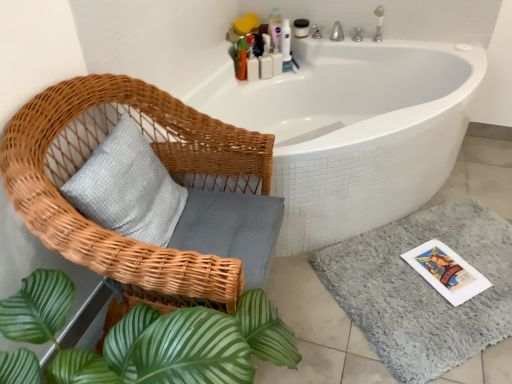
Find the location of a particular element. Image resolution: width=512 pixels, height=384 pixels. vacant space situated on the left part of silver metallic tap at upper right is located at coordinates (335, 39).